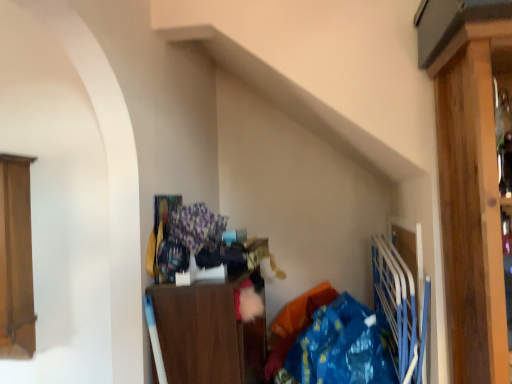
Question: From a real-world perspective, is blue plastic bag at lower right positioned above or below wooden cabinet at center, which ranks as the first cabinetry in right-to-left order?

Choices:
 (A) below
 (B) above

Answer: (A)

Question: Is blue plastic bag at lower right in front of or behind wooden cabinet at center, arranged as the 2th cabinetry when viewed from the left, in the image?

Choices:
 (A) behind
 (B) front

Answer: (B)

Question: Which is farther from the wooden cabinet at center, arranged as the 2th cabinetry when viewed from the left?

Choices:
 (A) wooden cabinet at left, positioned as the second cabinetry in right-to-left order
 (B) blue plastic bag at lower right

Answer: (A)

Question: Which object is the closest to the blue plastic bag at lower right?

Choices:
 (A) wooden cabinet at center, which ranks as the first cabinetry in right-to-left order
 (B) wooden cabinet at left, positioned as the second cabinetry in right-to-left order

Answer: (A)